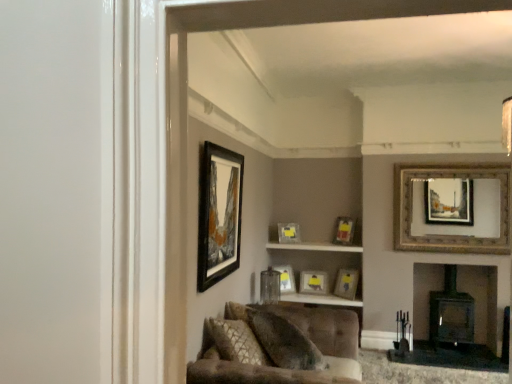
Question: Is point (228, 380) positioned closer to the camera than point (209, 249)?

Choices:
 (A) closer
 (B) farther

Answer: (A)

Question: In the image, is tufted fabric couch at lower center positioned in front of or behind black matte picture frame at upper center, acting as the 7th picture frame starting from the right?

Choices:
 (A) front
 (B) behind

Answer: (A)

Question: Which is farther from the velvet textured pillow at lower center?

Choices:
 (A) wooden picture frame at center, the 2th picture frame in the right-to-left sequence
 (B) tufted fabric couch at lower center
 (C) matte gold picture frame at center, the seventh picture frame positioned from the front
 (D) matte glass picture frame at center, positioned as the third picture frame in back-to-front order
 (E) matte gold picture frame at center, arranged as the 4th picture frame when viewed from the right

Answer: (A)

Question: Which of these objects is positioned farthest from the wooden picture frame at center, the sixth picture frame in the left-to-right sequence?

Choices:
 (A) matte gold picture frame at center, arranged as the 4th picture frame when viewed from the right
 (B) matte gold picture frame at center, positioned as the 4th picture frame in front-to-back order
 (C) gold/gilded picture frame at upper right, the sixth picture frame in the back-to-front sequence
 (D) matte glass cabinet at center
 (E) velvet textured pillow at lower center

Answer: (E)